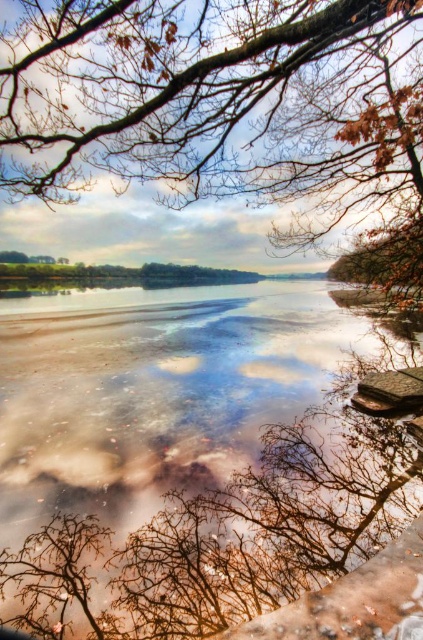
Can you confirm if translucent glass river at center is taller than brown textured branches at upper center?

Correct, translucent glass river at center is much taller as brown textured branches at upper center.

Measure the distance between translucent glass river at center and camera.

A distance of 10.01 feet exists between translucent glass river at center and camera.

At what (x,y) coordinates should I click in order to perform the action: click on translucent glass river at center. Please return your answer as a coordinate pair (x, y). Looking at the image, I should click on (189, 458).